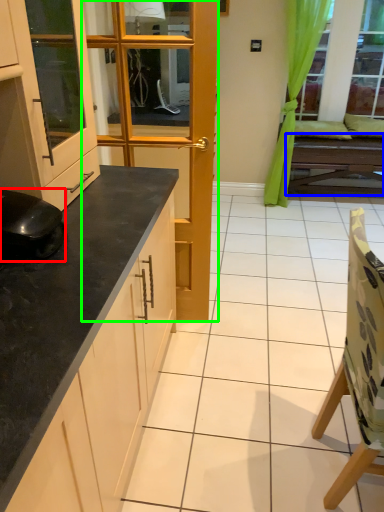
Question: Based on their relative distances, which object is nearer to appliance (highlighted by a red box)? Choose from table (highlighted by a blue box) and door (highlighted by a green box).

Choices:
 (A) table
 (B) door

Answer: (B)